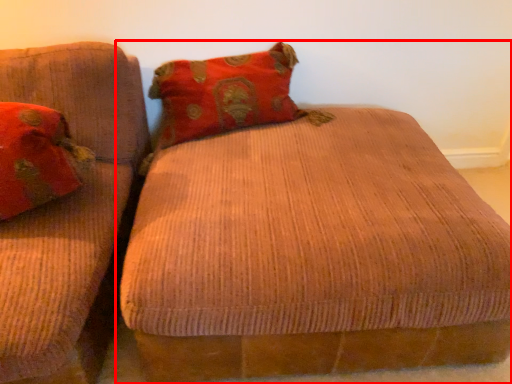
Question: From the image's perspective, where is studio couch (annotated by the red box) located in relation to pillow in the image?

Choices:
 (A) below
 (B) above

Answer: (A)